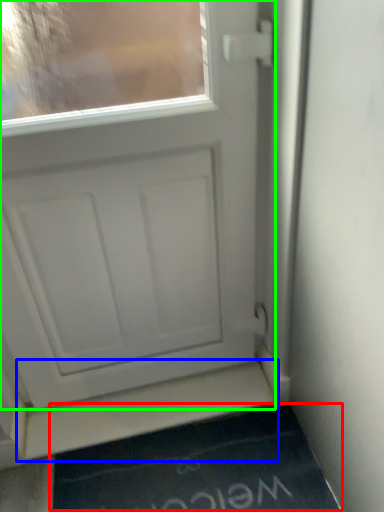
Question: Which is farther away from doormat (highlighted by a red box)? stairwell (highlighted by a blue box) or door (highlighted by a green box)?

Choices:
 (A) stairwell
 (B) door

Answer: (B)